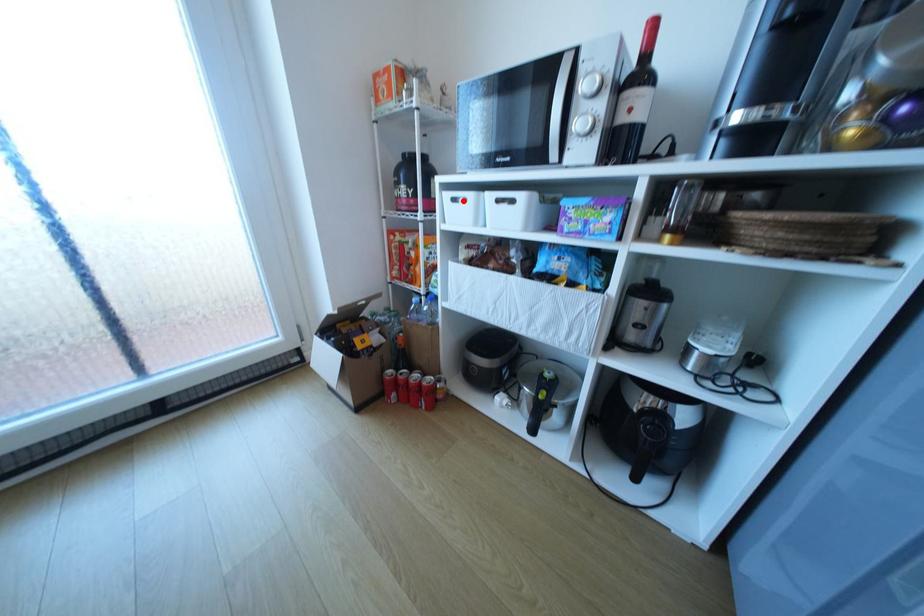
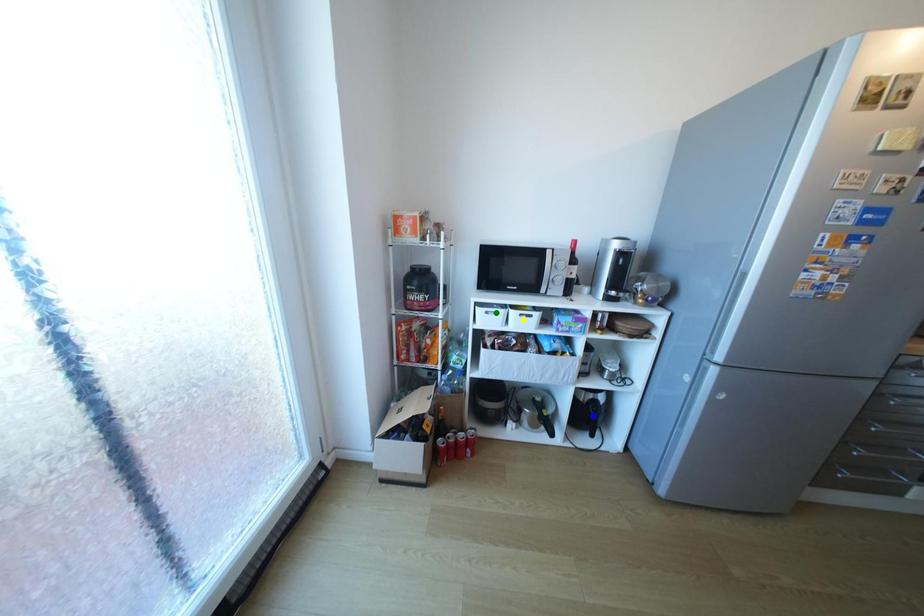
Question: I am providing you with two images of the same scene from different viewpoints. A red point is marked on the first image. You are given multiple points on the second image. Which point in image 2 is actually the same real-world point as the red point in image 1?

Choices:
 (A) blue point
 (B) yellow point
 (C) green point

Answer: (C)